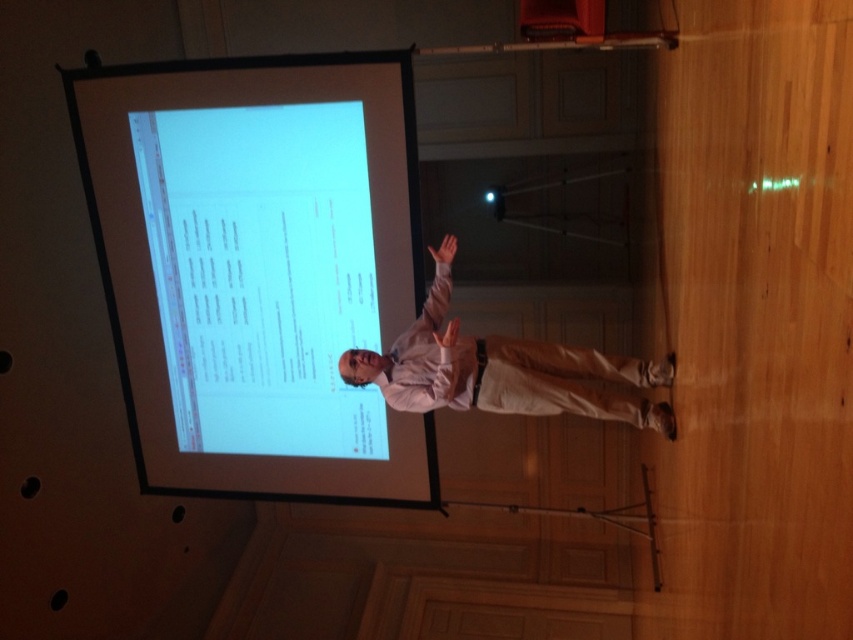
Is point (225, 364) less distant than point (444, 394)?

No, it is not.

Does point (265, 490) lie behind point (381, 369)?

Yes, it is.

The height and width of the screenshot is (640, 853). I want to click on white glossy projection screen at upper center, so click(257, 268).